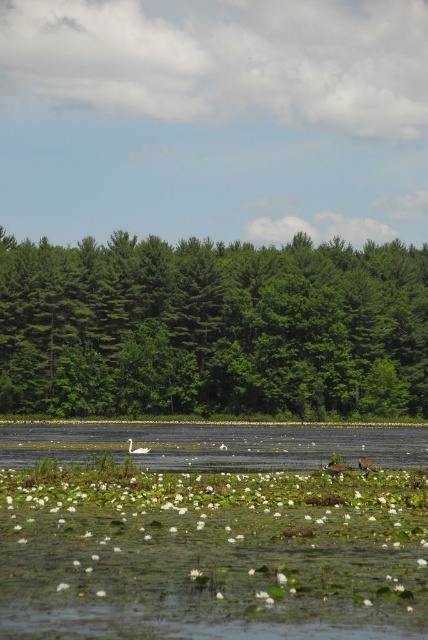
Question: Is green leafy trees at center above white matte duck at center?

Choices:
 (A) no
 (B) yes

Answer: (B)

Question: Which object is farther from the camera taking this photo?

Choices:
 (A) clear water at center
 (B) green leafy trees at center
 (C) white matte duck at center

Answer: (B)

Question: Does green leafy trees at center have a smaller size compared to white matte duck at center?

Choices:
 (A) yes
 (B) no

Answer: (B)

Question: Can you confirm if green leafy trees at center is wider than clear water at center?

Choices:
 (A) yes
 (B) no

Answer: (A)

Question: Which point is farther to the camera?

Choices:
 (A) white matte duck at center
 (B) green leafy trees at center
 (C) clear water at center

Answer: (B)

Question: Which point is closer to the camera?

Choices:
 (A) (139, 451)
 (B) (85, 428)

Answer: (A)